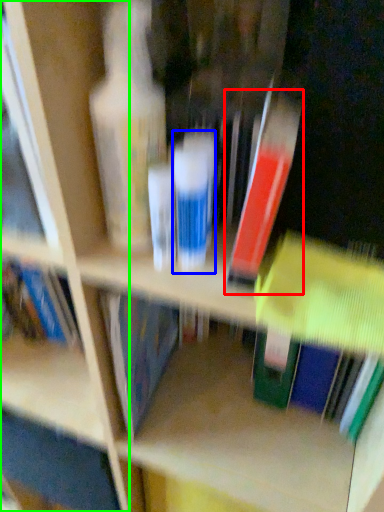
Question: Which object is the closest to the book (highlighted by a red box)? Choose among these: toiletry (highlighted by a blue box) or shelf (highlighted by a green box).

Choices:
 (A) toiletry
 (B) shelf

Answer: (A)